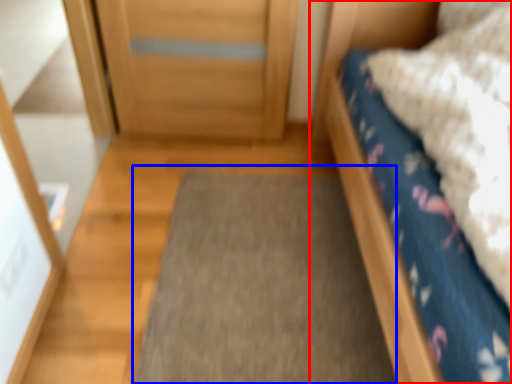
Question: Which object is further to the camera taking this photo, bed (highlighted by a red box) or doormat (highlighted by a blue box)?

Choices:
 (A) bed
 (B) doormat

Answer: (B)